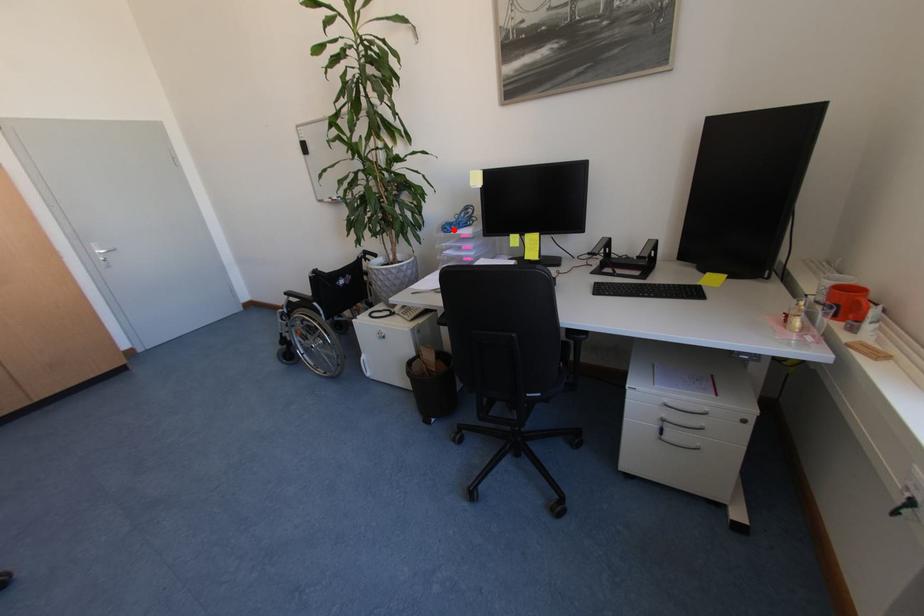
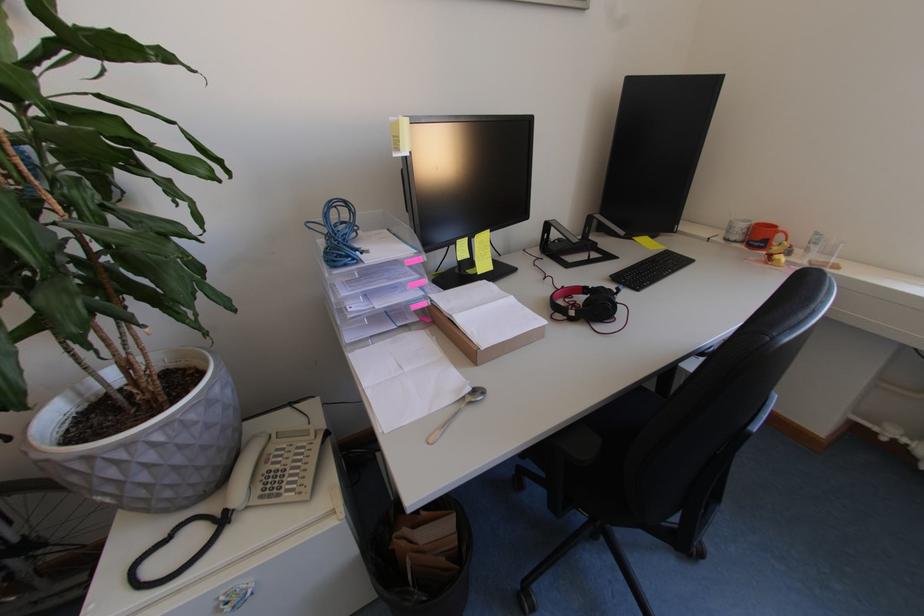
Where in the second image is the point corresponding to the highlighted location from the first image?

(356, 257)